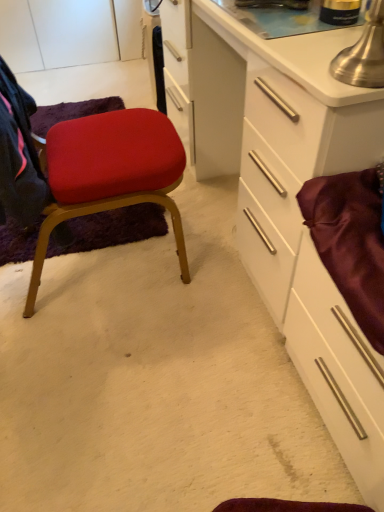
Question: Does white glossy cabinet at center have a lesser width compared to matte fabric chair at left?

Choices:
 (A) no
 (B) yes

Answer: (B)

Question: Considering the relative positions of white glossy cabinet at center and matte fabric chair at left in the image provided, is white glossy cabinet at center behind matte fabric chair at left?

Choices:
 (A) yes
 (B) no

Answer: (B)

Question: Is white glossy cabinet at center not within matte fabric chair at left?

Choices:
 (A) yes
 (B) no

Answer: (A)

Question: Is white glossy cabinet at center oriented away from matte fabric chair at left?

Choices:
 (A) no
 (B) yes

Answer: (B)

Question: Does white glossy cabinet at center appear on the left side of matte fabric chair at left?

Choices:
 (A) no
 (B) yes

Answer: (A)

Question: From the image's perspective, is white glossy cabinet at center below matte fabric chair at left?

Choices:
 (A) no
 (B) yes

Answer: (A)

Question: Considering the relative sizes of satin burgundy drawer at right and white glossy cabinet at center in the image provided, is satin burgundy drawer at right shorter than white glossy cabinet at center?

Choices:
 (A) no
 (B) yes

Answer: (B)

Question: Is satin burgundy drawer at right to the left of white glossy cabinet at center from the viewer's perspective?

Choices:
 (A) yes
 (B) no

Answer: (B)

Question: Considering the relative sizes of satin burgundy drawer at right and white glossy cabinet at center in the image provided, is satin burgundy drawer at right thinner than white glossy cabinet at center?

Choices:
 (A) yes
 (B) no

Answer: (A)

Question: From a real-world perspective, is satin burgundy drawer at right positioned under white glossy cabinet at center based on gravity?

Choices:
 (A) yes
 (B) no

Answer: (A)

Question: From a real-world perspective, is satin burgundy drawer at right physically above white glossy cabinet at center?

Choices:
 (A) no
 (B) yes

Answer: (A)

Question: Is satin burgundy drawer at right oriented towards white glossy cabinet at center?

Choices:
 (A) no
 (B) yes

Answer: (A)

Question: From the image's perspective, does satin burgundy drawer at right appear higher than matte fabric chair at left?

Choices:
 (A) yes
 (B) no

Answer: (B)